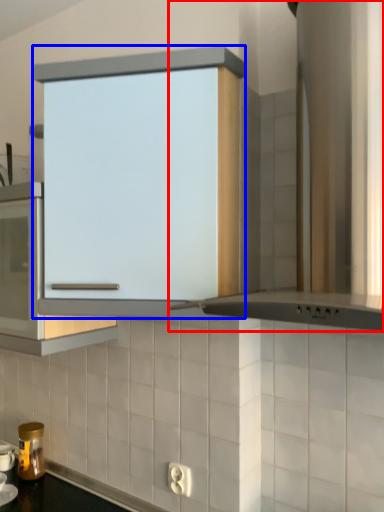
Question: Which object is further to the camera taking this photo, home appliance (highlighted by a red box) or cabinetry (highlighted by a blue box)?

Choices:
 (A) home appliance
 (B) cabinetry

Answer: (B)